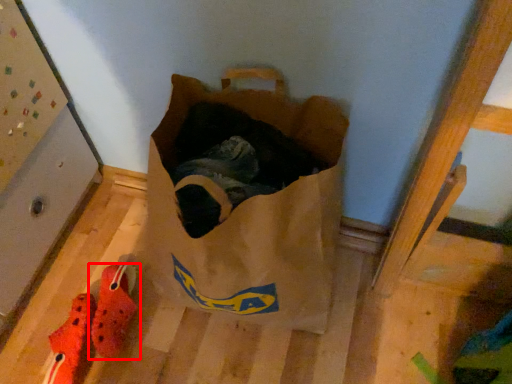
Question: From the image's perspective, what is the correct spatial positioning of footwear (annotated by the red box) in reference to footwear?

Choices:
 (A) above
 (B) below

Answer: (A)